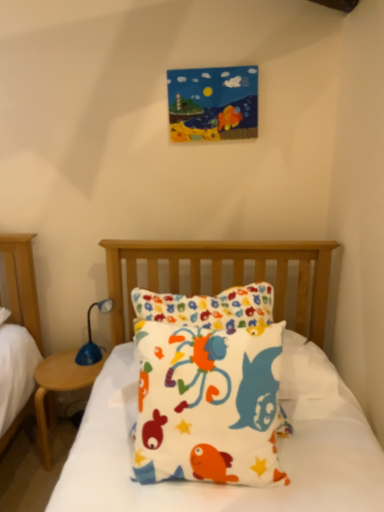
The image size is (384, 512). Identify the location of wooden at left. (58, 389).

What do you see at coordinates (91, 338) in the screenshot? The height and width of the screenshot is (512, 384). I see `blue plastic table lamp at left` at bounding box center [91, 338].

Where is `fluffy cotton pillow at center`? This screenshot has width=384, height=512. fluffy cotton pillow at center is located at coordinates (280, 397).

Is wooden at left positioned far away from fluffy cotton pillow at center?

They are positioned close to each other.

Which is more to the left, wooden at left or fluffy cotton pillow at center?

Positioned to the left is wooden at left.

Do you think wooden at left is within fluffy cotton pillow at center, or outside of it?

wooden at left cannot be found inside fluffy cotton pillow at center.

Measure the distance between blue plastic table lamp at left and fluffy cotton pillow at center.

blue plastic table lamp at left and fluffy cotton pillow at center are 24.11 inches apart.

Locate an element on the screen. bed below the blue plastic table lamp at left (from the image's perspective) is located at coordinates (280, 397).

Does blue plastic table lamp at left have a lesser width compared to fluffy cotton pillow at center?

Indeed, blue plastic table lamp at left has a lesser width compared to fluffy cotton pillow at center.

Considering the relative sizes of blue plastic table lamp at left and fluffy cotton pillow at center in the image provided, is blue plastic table lamp at left shorter than fluffy cotton pillow at center?

Indeed, blue plastic table lamp at left has a lesser height compared to fluffy cotton pillow at center.

Are fluffy cotton pillow at center and blue plastic table lamp at left beside each other?

No, fluffy cotton pillow at center is not in contact with blue plastic table lamp at left.

Is fluffy cotton pillow at center oriented towards blue plastic table lamp at left?

No, fluffy cotton pillow at center is not aimed at blue plastic table lamp at left.

Is fluffy cotton pillow at center thinner than blue plastic table lamp at left?

Incorrect, the width of fluffy cotton pillow at center is not less than that of blue plastic table lamp at left.

Looking at this image, considering the relative sizes of fluffy cotton pillow at center and blue plastic table lamp at left in the image provided, is fluffy cotton pillow at center shorter than blue plastic table lamp at left?

In fact, fluffy cotton pillow at center may be taller than blue plastic table lamp at left.

What's the angular difference between blue plastic table lamp at left and wooden at left's facing directions?

blue plastic table lamp at left and wooden at left are facing 52.2 degrees away from each other.

Is blue plastic table lamp at left with wooden at left?

No, blue plastic table lamp at left is not next to wooden at left.

Is wooden at left a part of blue plastic table lamp at left?

Definitely not — wooden at left is not inside blue plastic table lamp at left.

Measure the distance from fluffy cotton pillow at center to wooden at left.

fluffy cotton pillow at center is 23.84 inches away from wooden at left.

Would you consider fluffy cotton pillow at center to be distant from wooden at left?

No.

In terms of size, does fluffy cotton pillow at center appear bigger or smaller than wooden at left?

fluffy cotton pillow at center is bigger than wooden at left.

Considering the relative sizes of fluffy cotton pillow at center and wooden at left in the image provided, is fluffy cotton pillow at center thinner than wooden at left?

Correct, the width of fluffy cotton pillow at center is less than that of wooden at left.

From the picture: Can you confirm if wooden at left is thinner than blue plastic table lamp at left?

No.

Is wooden at left bigger than blue plastic table lamp at left?

Yes, wooden at left is bigger than blue plastic table lamp at left.

From the image's perspective, is wooden at left beneath blue plastic table lamp at left?

Yes, from the image's perspective, wooden at left is below blue plastic table lamp at left.

Based on the photo, is wooden at left far away from blue plastic table lamp at left?

Actually, wooden at left and blue plastic table lamp at left are a little close together.

Where is `nightstand below the fluffy cotton pillow at center (from a real-world perspective)`? nightstand below the fluffy cotton pillow at center (from a real-world perspective) is located at coordinates (58, 389).

Locate an element on the screen. bed that is on the right side of blue plastic table lamp at left is located at coordinates (280, 397).

When comparing their distances from wooden at left, does blue plastic table lamp at left or fluffy cotton pillow at center seem closer?

blue plastic table lamp at left.

Estimate the real-world distances between objects in this image. Which object is further from blue plastic table lamp at left, fluffy cotton pillow at center or wooden at left?

fluffy cotton pillow at center lies further to blue plastic table lamp at left than the other object.

From the image, which object appears to be farther from fluffy cotton pillow at center, wooden at left or blue plastic table lamp at left?

Based on the image, blue plastic table lamp at left appears to be further to fluffy cotton pillow at center.

Which object lies nearer to the anchor point blue plastic table lamp at left, wooden at left or fluffy cotton pillow at center?

wooden at left lies closer to blue plastic table lamp at left than the other object.

Consider the image. Which object lies further to the anchor point wooden at left, fluffy cotton pillow at center or blue plastic table lamp at left?

Among the two, fluffy cotton pillow at center is located further to wooden at left.

Estimate the real-world distances between objects in this image. Which object is further from fluffy cotton pillow at center, blue plastic table lamp at left or wooden at left?

blue plastic table lamp at left is further to fluffy cotton pillow at center.

This screenshot has height=512, width=384. I want to click on nightstand between fluffy cotton pillow at center and blue plastic table lamp at left in the front-back direction, so click(58, 389).